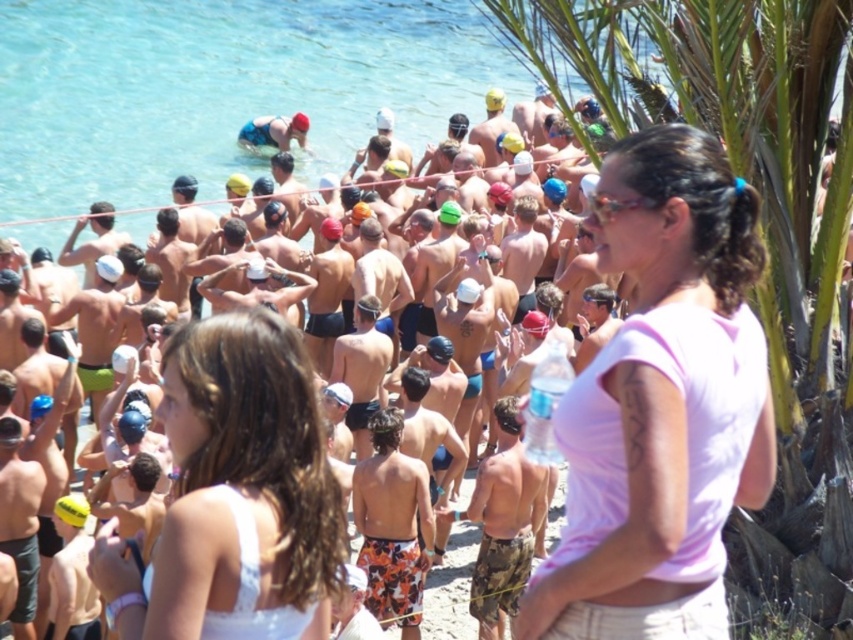
You are standing at the beach and see two points marked in the image. The first point is at coordinates point (686,275) and the second is at point (432,636). Which point is closer to you?

Point (686,275) is in front of point (432,636), so it is closer to you.

You are a photographer at the beach event. You need to capture a photo where both the pink fabric shirt at center and the clear blue water at center are visible. Based on their heights, which object should you ensure is closer to the bottom of the frame to include both in the shot?

The pink fabric shirt at center has a lesser height compared to the clear blue water at center, so you should position the pink fabric shirt at center closer to the bottom of the frame to ensure both are visible.

In the scene shown: You are a swimmer preparing for a race and see the pink fabric shirt at center and the clear blue water at center. Which item is more likely to allow you to move faster through it?

The pink fabric shirt at center is thinner than the clear blue water at center, so moving through the pink fabric shirt at center would be easier and faster.